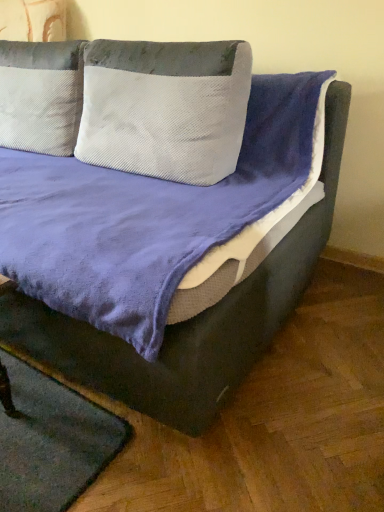
Question: Considering the relative sizes of velvet purple bed at center and white textured pillow at center in the image provided, is velvet purple bed at center wider than white textured pillow at center?

Choices:
 (A) no
 (B) yes

Answer: (B)

Question: Does velvet purple bed at center have a larger size compared to white textured pillow at center?

Choices:
 (A) yes
 (B) no

Answer: (A)

Question: Is velvet purple bed at center located outside white textured pillow at center?

Choices:
 (A) no
 (B) yes

Answer: (B)

Question: Does velvet purple bed at center have a smaller size compared to white textured pillow at center?

Choices:
 (A) no
 (B) yes

Answer: (A)

Question: Is velvet purple bed at center next to white textured pillow at center and touching it?

Choices:
 (A) no
 (B) yes

Answer: (A)

Question: In terms of size, does white textured pillow at center appear bigger or smaller than green felt mat at lower left?

Choices:
 (A) small
 (B) big

Answer: (B)

Question: From a real-world perspective, is white textured pillow at center above or below green felt mat at lower left?

Choices:
 (A) above
 (B) below

Answer: (A)

Question: Is white textured pillow at center to the left or to the right of green felt mat at lower left in the image?

Choices:
 (A) right
 (B) left

Answer: (A)

Question: Considering the positions of white textured pillow at center and green felt mat at lower left in the image, is white textured pillow at center taller or shorter than green felt mat at lower left?

Choices:
 (A) short
 (B) tall

Answer: (B)

Question: Based on their positions, is green felt mat at lower left located to the left or right of white textured pillow at center?

Choices:
 (A) left
 (B) right

Answer: (A)

Question: Is green felt mat at lower left in front of or behind white textured pillow at center in the image?

Choices:
 (A) front
 (B) behind

Answer: (A)

Question: Considering the positions of green felt mat at lower left and white textured pillow at center in the image, is green felt mat at lower left wider or thinner than white textured pillow at center?

Choices:
 (A) wide
 (B) thin

Answer: (A)

Question: Does point (8, 471) appear closer or farther from the camera than point (79, 122)?

Choices:
 (A) closer
 (B) farther

Answer: (A)

Question: From the image's perspective, is velvet purple bed at center located above or below green felt mat at lower left?

Choices:
 (A) below
 (B) above

Answer: (B)

Question: Based on their positions, is velvet purple bed at center located to the left or right of green felt mat at lower left?

Choices:
 (A) left
 (B) right

Answer: (A)